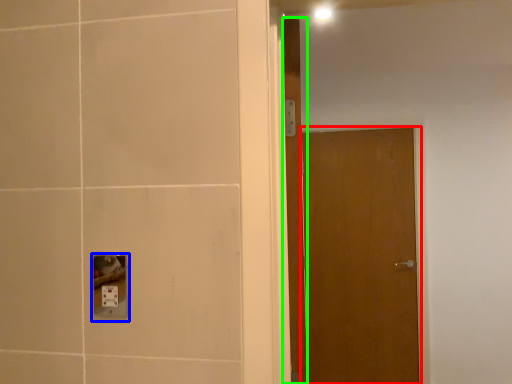
Question: Based on their relative distances, which object is farther from door (highlighted by a red box)? Choose from socket (highlighted by a blue box) and door (highlighted by a green box).

Choices:
 (A) socket
 (B) door

Answer: (A)